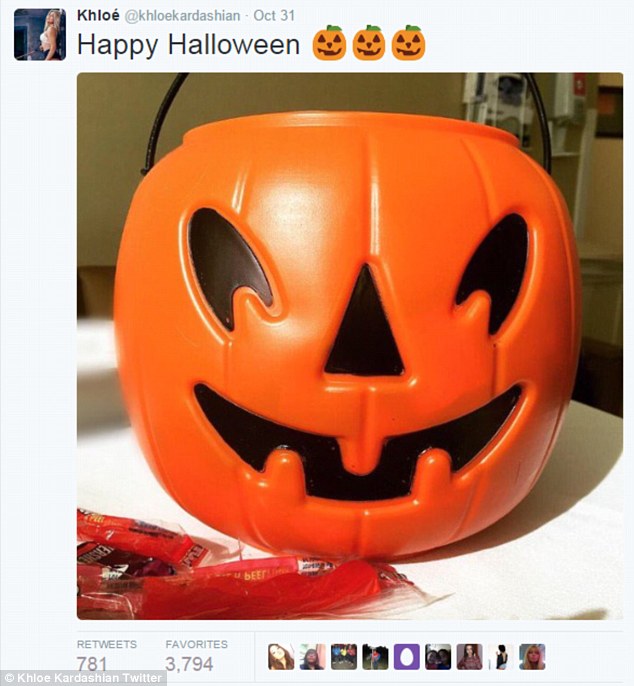
You are a GUI agent. You are given a task and a screenshot of the screen. Output one action in this format:
    pyautogui.click(x=<x>, y=<y>)
    Task: Click on the white table top
    The height and width of the screenshot is (686, 634).
    Given the screenshot: What is the action you would take?
    [113, 460]